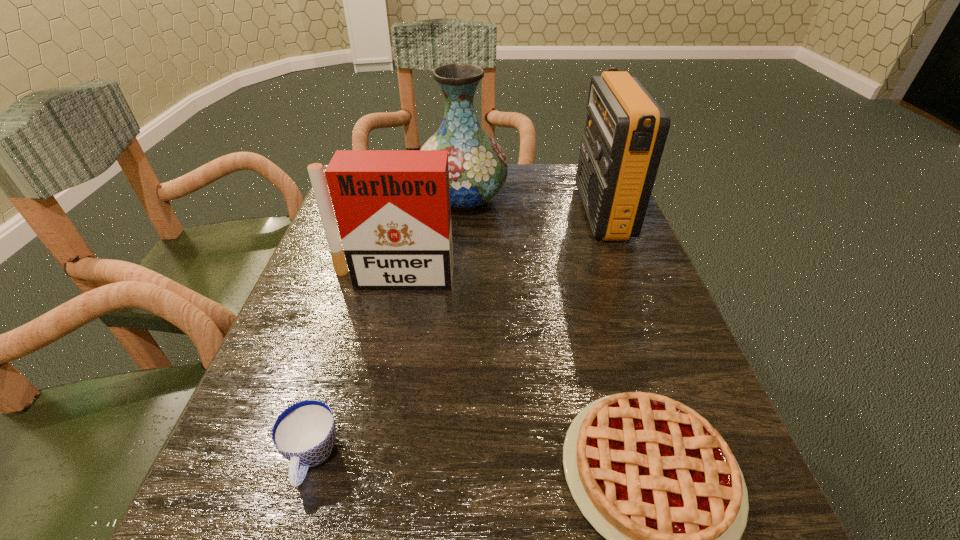
I want to click on radio receiver that is at the far edge, so click(626, 129).

I want to click on cigarette case situated at the left edge, so click(x=392, y=207).

Where is `cup situated at the left edge`? This screenshot has width=960, height=540. cup situated at the left edge is located at coordinates (304, 433).

Locate an element on the screen. The height and width of the screenshot is (540, 960). object at the right edge is located at coordinates [x=626, y=129].

Where is `object that is at the far right corner`? object that is at the far right corner is located at coordinates (626, 129).

Find the location of a particular element. The height and width of the screenshot is (540, 960). free spot at the far edge of the desktop is located at coordinates (553, 205).

Identify the location of vacant region at the left edge of the desktop. (358, 349).

The height and width of the screenshot is (540, 960). In the image, there is a desktop. Identify the location of free region at the right edge. pyautogui.click(x=636, y=306).

This screenshot has height=540, width=960. Find the location of `free space between the fourth tallest object and the vase`. free space between the fourth tallest object and the vase is located at coordinates (387, 328).

Image resolution: width=960 pixels, height=540 pixels. Identify the location of free space between the third farthest object and the radio receiver. (497, 245).